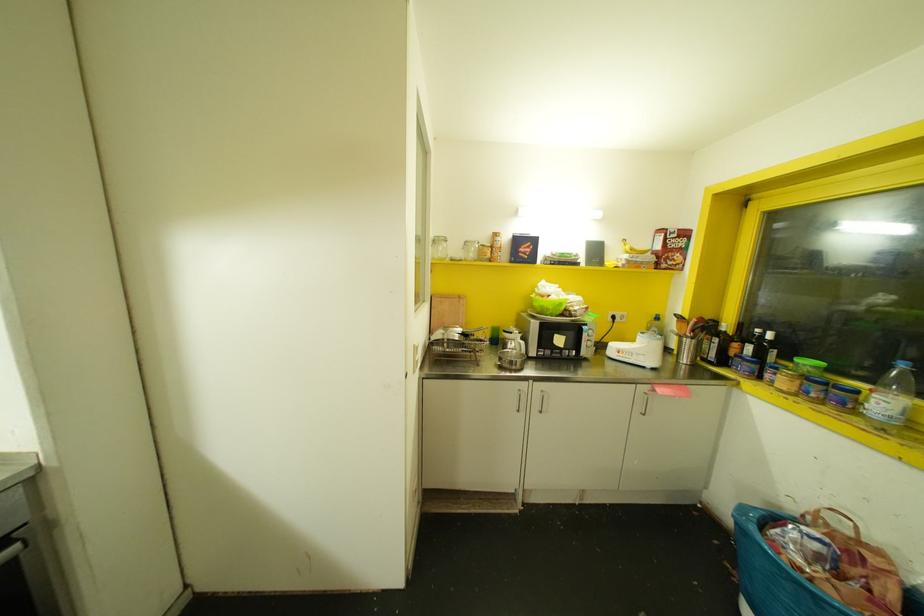
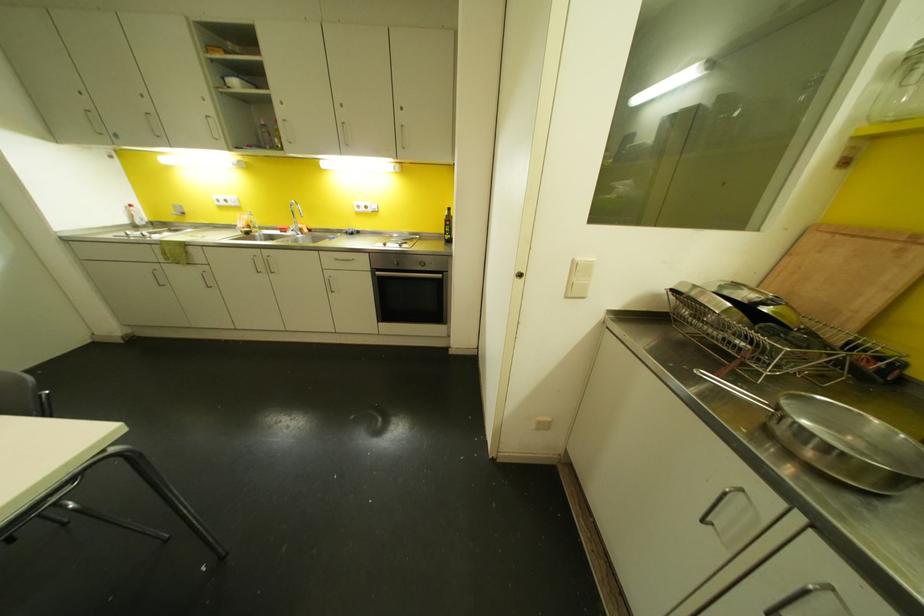
How did the camera likely rotate?

The camera rotated toward left-down.